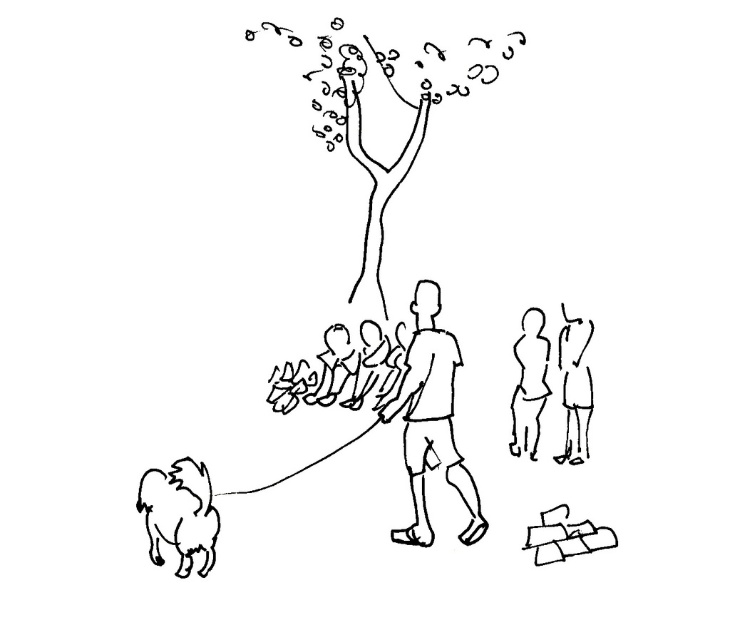
You are standing in the scene and see the smooth skin figure at center and the smooth skin child at right. Which one is closer to the right edge of the image?

The smooth skin child at right is closer to the right edge of the image because the smooth skin figure at center is to the left of it.

You are standing in the scene depicted in the image and want to determine the relative positions of two points. The first point is at coordinates point [456,460] and the second point is at point [531,451]. Based on the scene description, which point is closer to you?

Point [456,460] is closer to the camera than point [531,451].

You are standing at the edge of the scene observing the smooth skin figure at center and the smooth skin figure at right. Which one is positioned lower in the drawing?

The smooth skin figure at center is located below the smooth skin figure at right, so the smooth skin figure at center is positioned lower in the drawing.